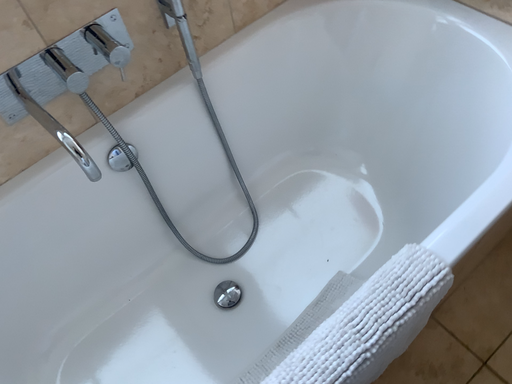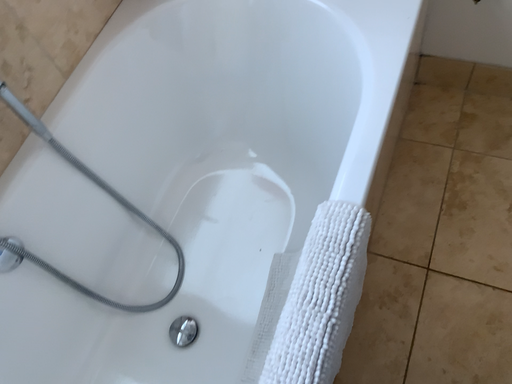
Question: How did the camera likely rotate when shooting the video?

Choices:
 (A) rotated left
 (B) rotated right

Answer: (B)